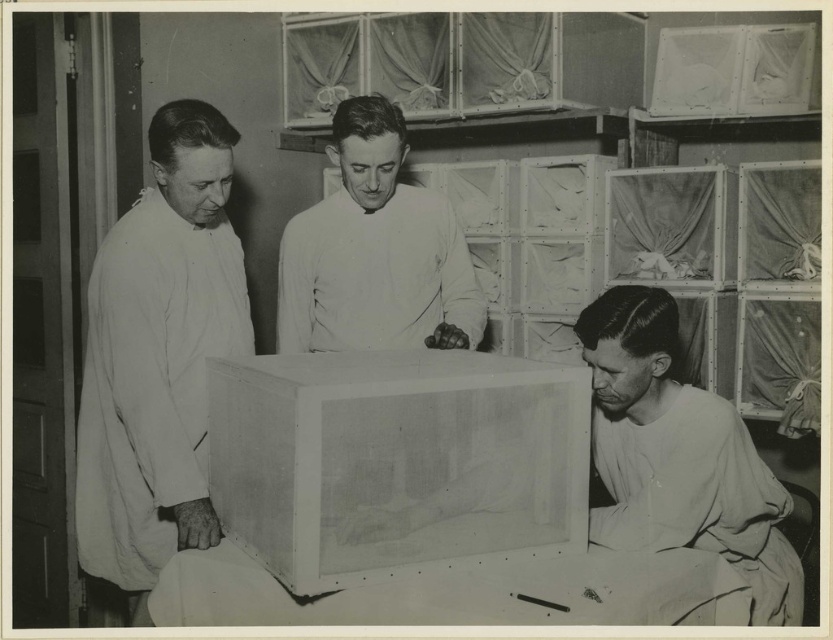
Question: Observing the image, what is the correct spatial positioning of translucent plastic box at center in reference to smooth white shirt at lower right?

Choices:
 (A) left
 (B) right

Answer: (A)

Question: Based on their relative distances, which object is nearer to the translucent plastic box at center?

Choices:
 (A) white matte coat at center
 (B) white cloth at left

Answer: (B)

Question: Can you confirm if smooth white shirt at lower right is positioned below white matte coat at center?

Choices:
 (A) no
 (B) yes

Answer: (B)

Question: Can you confirm if white cloth at left is smaller than white matte coat at center?

Choices:
 (A) no
 (B) yes

Answer: (A)

Question: Which object is farther from the camera taking this photo?

Choices:
 (A) translucent plastic box at center
 (B) white cloth at left

Answer: (B)

Question: Which of these objects is positioned closest to the white matte coat at center?

Choices:
 (A) white cloth at left
 (B) translucent plastic box at center

Answer: (A)